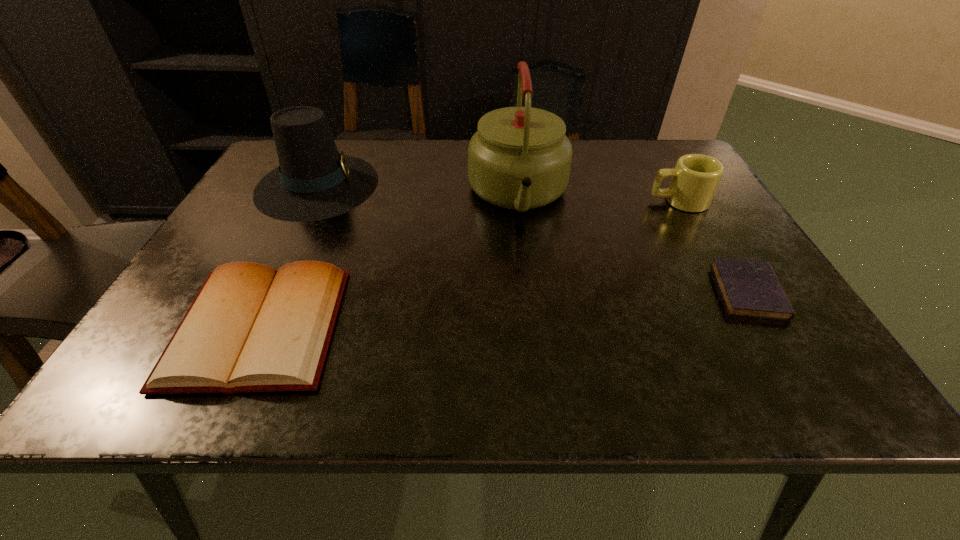
Identify the location of free region located 0.260m with the handle on the side of the mug. This screenshot has width=960, height=540. (542, 201).

Find the location of a particular element. This screenshot has height=540, width=960. free spot located 0.130m on the right of the fourth tallest object is located at coordinates (409, 327).

Where is `free space located on the front of the diary`? The image size is (960, 540). free space located on the front of the diary is located at coordinates (782, 348).

The height and width of the screenshot is (540, 960). In order to click on kettle that is at the far edge in this screenshot , I will do `click(520, 158)`.

Identify the location of hat at the far edge. This screenshot has width=960, height=540. (314, 181).

The image size is (960, 540). I want to click on object situated at the near edge, so click(251, 328).

Where is `hat situated at the left edge`? This screenshot has height=540, width=960. hat situated at the left edge is located at coordinates (314, 181).

Identify the location of Bible positioned at the left edge. The height and width of the screenshot is (540, 960). (251, 328).

Find the location of `mug at the right edge`. mug at the right edge is located at coordinates (695, 178).

The height and width of the screenshot is (540, 960). I want to click on diary at the right edge, so click(749, 288).